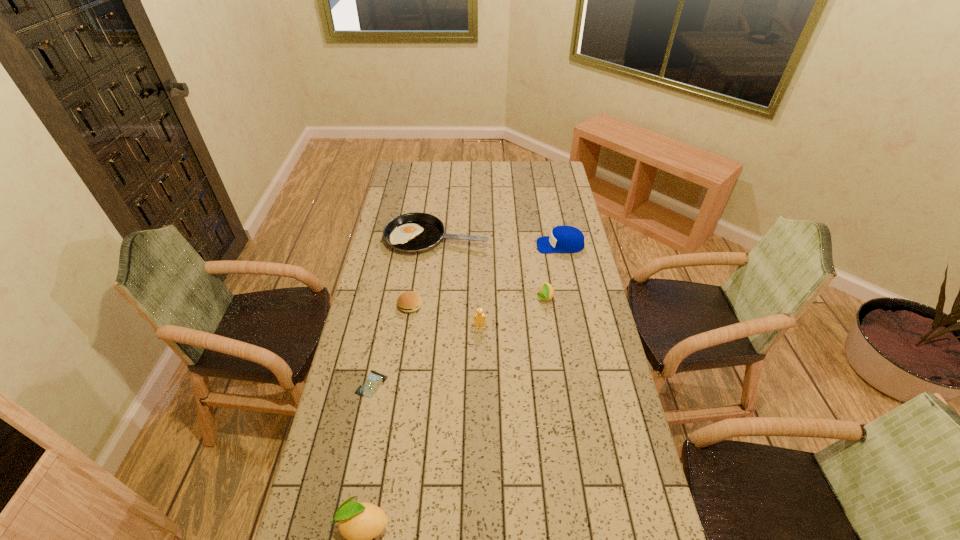
This screenshot has height=540, width=960. What are the coordinates of `the right lemon` in the screenshot? It's located at (546, 291).

Identify the location of the shorter lemon. (546, 291).

This screenshot has width=960, height=540. I want to click on frying pan, so click(x=416, y=232).

Identify the location of the sixth tallest object. This screenshot has width=960, height=540. (410, 301).

Where is `the shortest object`? The height and width of the screenshot is (540, 960). the shortest object is located at coordinates (374, 380).

Locate an element on the screen. This screenshot has height=540, width=960. identity card is located at coordinates (374, 380).

Identify the location of baseball cap. (563, 239).

In order to click on Lego in this screenshot , I will do `click(479, 318)`.

The width and height of the screenshot is (960, 540). Identify the location of vacant region located with leaves positioned above the farther lemon. (551, 345).

The height and width of the screenshot is (540, 960). Identify the location of blank space located 0.090m on the back of the frying pan. (440, 208).